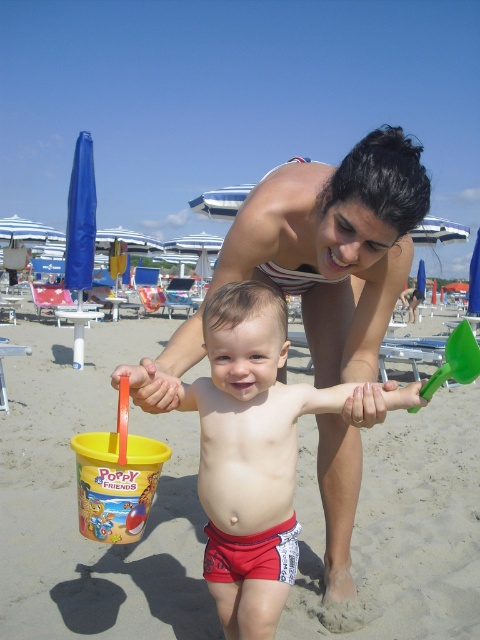
Who is positioned more to the left, smooth red shorts at center or red cotton diaper at center?

red cotton diaper at center

What do you see at coordinates (250, 452) in the screenshot? The width and height of the screenshot is (480, 640). I see `smooth red shorts at center` at bounding box center [250, 452].

I want to click on smooth red shorts at center, so click(250, 452).

Looking at this image, between red cotton diaper at center and green plastic shovel at lower right, which one has more height?

green plastic shovel at lower right is taller.

Who is shorter, red cotton diaper at center or green plastic shovel at lower right?

Standing shorter between the two is red cotton diaper at center.

Describe the element at coordinates (252, 554) in the screenshot. The image size is (480, 640). I see `red cotton diaper at center` at that location.

The width and height of the screenshot is (480, 640). In order to click on red cotton diaper at center in this screenshot , I will do `click(252, 554)`.

This screenshot has height=640, width=480. Identify the location of smooth red shorts at center. (250, 452).

In order to click on smooth red shorts at center in this screenshot , I will do `click(250, 452)`.